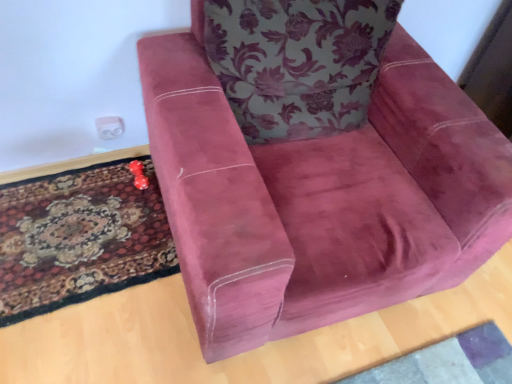
At what (x,y) coordinates should I click in order to perform the action: click on free space in front of rubberized red dice at lower left. Please return your answer as a coordinate pair (x, y). The image size is (512, 384). Looking at the image, I should click on (121, 205).